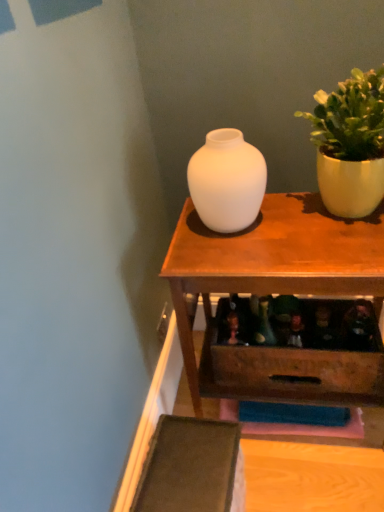
This screenshot has height=512, width=384. I want to click on free space that is to the left of matte yellow pot at upper right, so click(273, 233).